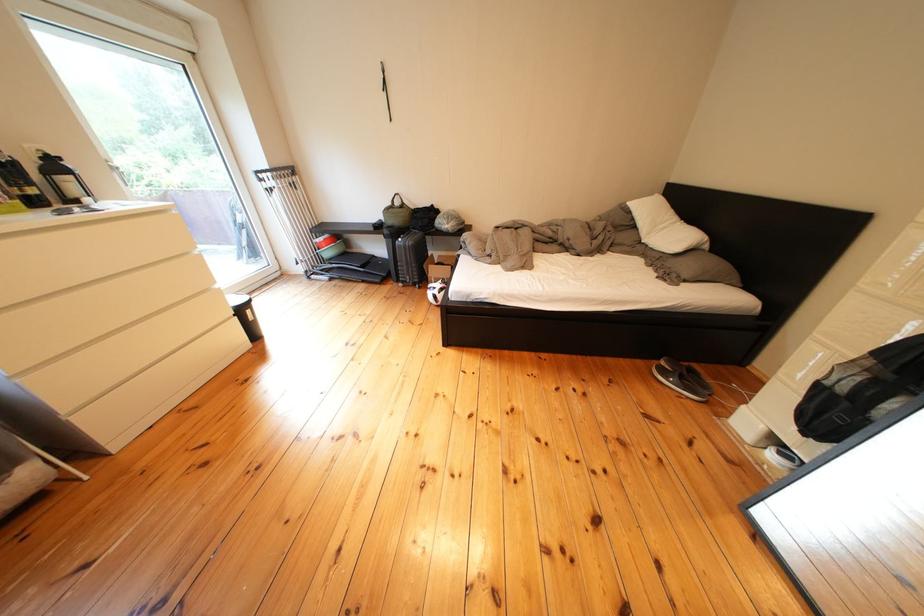
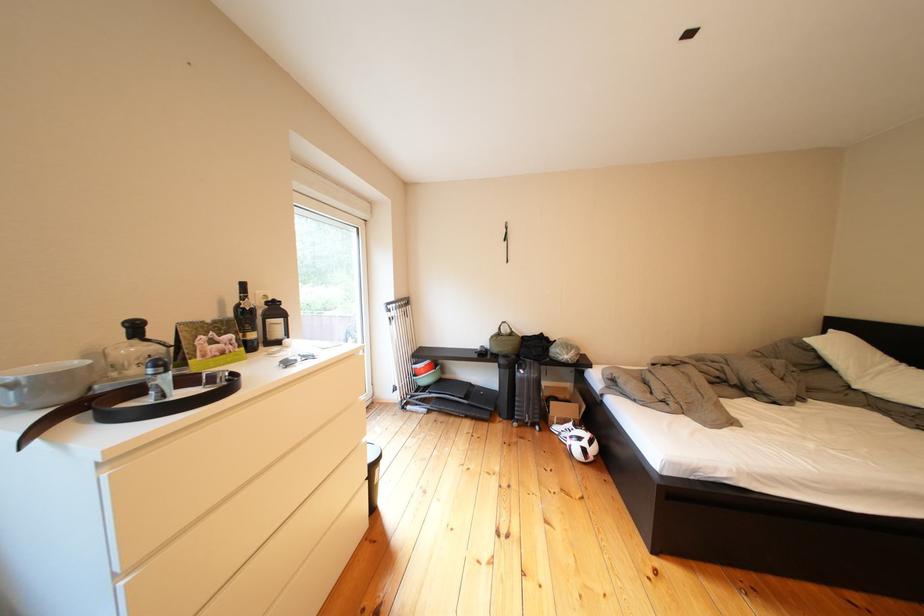
Question: What movement of the cameraman would produce the second image?

Choices:
 (A) Left
 (B) Right
 (C) Forward
 (D) Backward

Answer: (A)